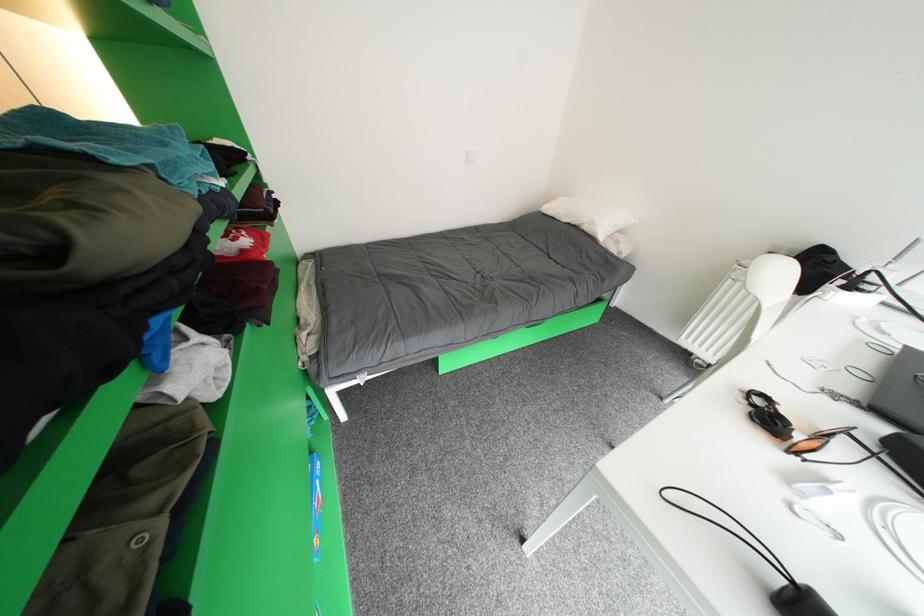
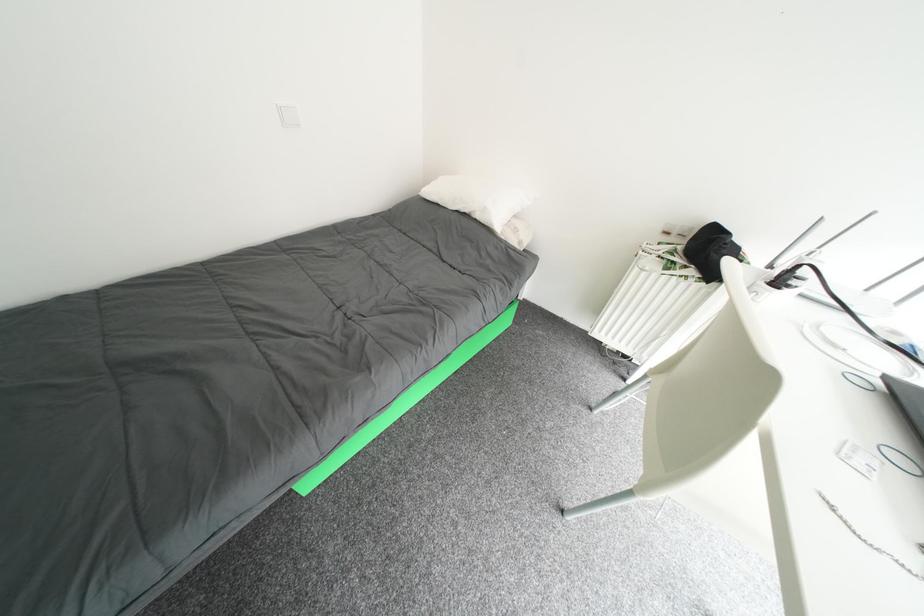
Question: The images are taken continuously from a first-person perspective. In which direction is your viewpoint rotating?

Choices:
 (A) Left
 (B) Right
 (C) Up
 (D) Down

Answer: (B)